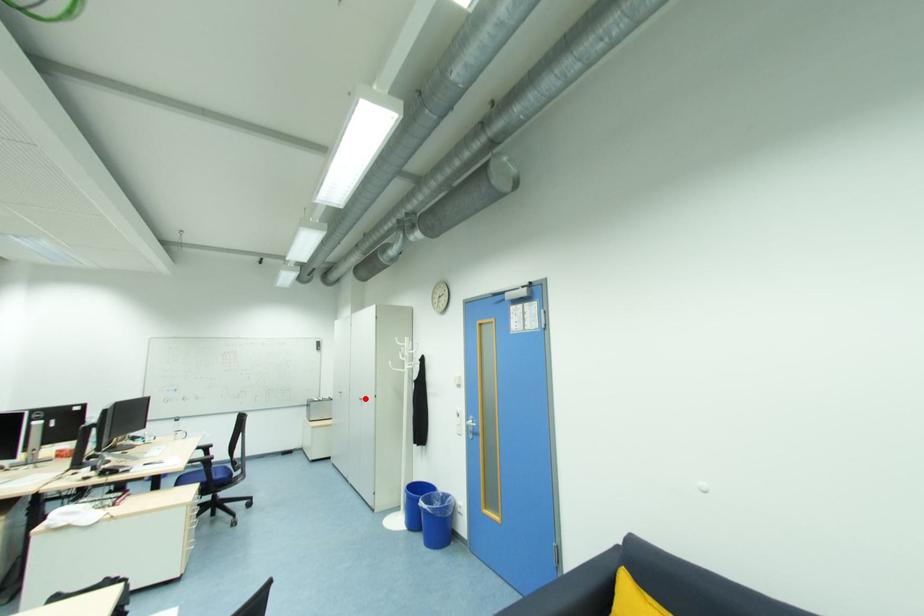
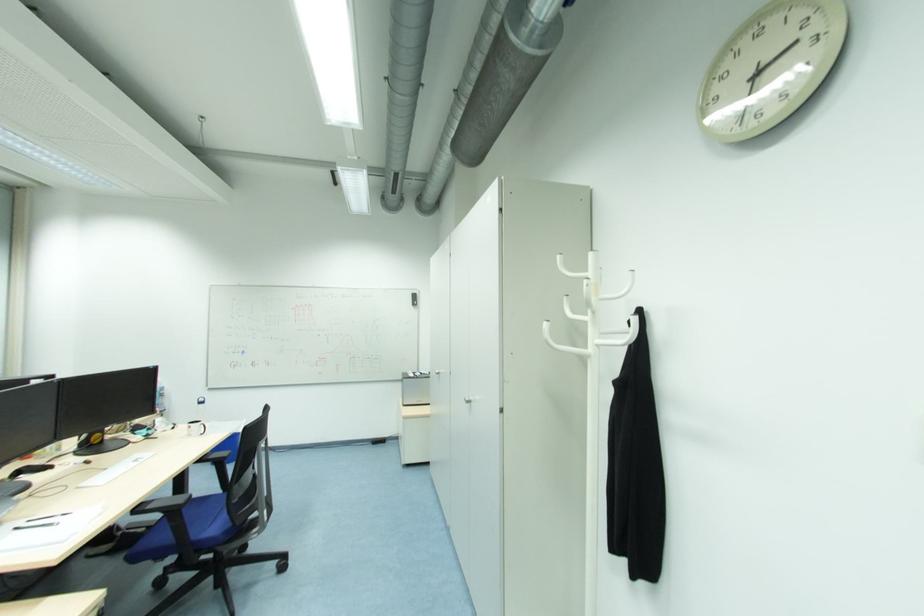
Question: I am providing you with two images of the same scene from different viewpoints. Image1 has a red point marked. In image2, the corresponding 3D location appears at what relative position? Reply with the corresponding letter.

Choices:
 (A) Closer
 (B) Farther

Answer: (A)